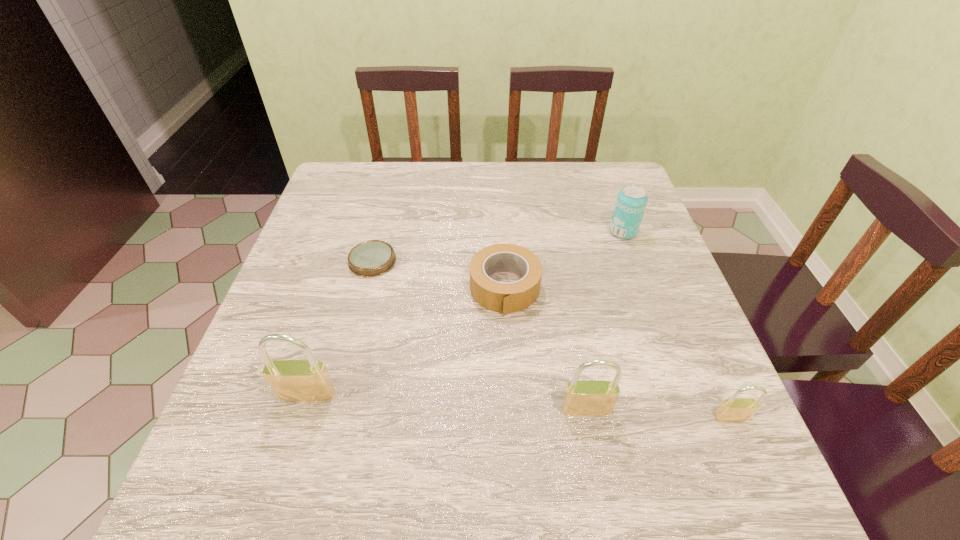
Locate an element on the screen. The image size is (960, 540). free space between the shortest padlock and the fifth tallest object is located at coordinates (618, 353).

You are a GUI agent. You are given a task and a screenshot of the screen. Output one action in this format:
    pyautogui.click(x=<x>, y=<y>)
    Task: Click on the vacant area between the compass and the third object from right to left
    The height and width of the screenshot is (540, 960).
    Given the screenshot: What is the action you would take?
    pyautogui.click(x=479, y=335)

The height and width of the screenshot is (540, 960). In order to click on vacant space that is in between the fourth farthest object and the third object from right to left in this screenshot , I will do `click(446, 402)`.

The width and height of the screenshot is (960, 540). What are the coordinates of `free space between the shortest object and the duct tape` in the screenshot? It's located at (439, 275).

Identify the location of free space between the fourth shortest object and the fourth tallest object. The height and width of the screenshot is (540, 960). (678, 325).

Identify the location of free area in between the shortest padlock and the shortest object. (552, 339).

Where is `object that stands as the fourth closest to the fourth object from right to left`? Image resolution: width=960 pixels, height=540 pixels. object that stands as the fourth closest to the fourth object from right to left is located at coordinates (308, 380).

Choose which object is the fifth nearest neighbor to the compass. Please provide its 2D coordinates. Your answer should be formatted as a tuple, i.e. [(x, y)], where the tuple contains the x and y coordinates of a point satisfying the conditions above.

[(734, 409)]

Find the location of a particular element. Image resolution: width=960 pixels, height=540 pixels. padlock that is the second nearest to the fourth object from left to right is located at coordinates (308, 380).

Locate which padlock ranks second in proximity to the second object from right to left. Please provide its 2D coordinates. Your answer should be formatted as a tuple, i.e. [(x, y)], where the tuple contains the x and y coordinates of a point satisfying the conditions above.

[(734, 409)]